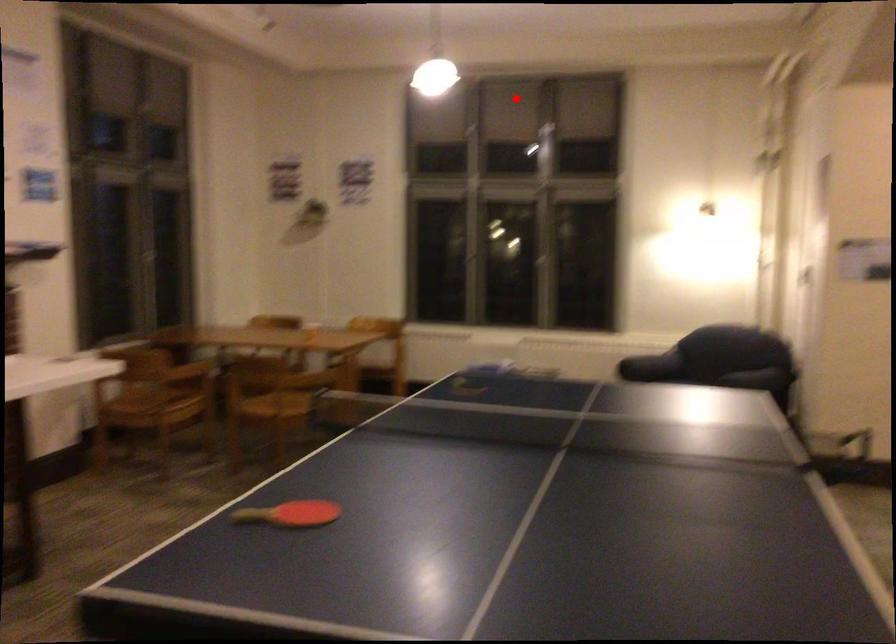
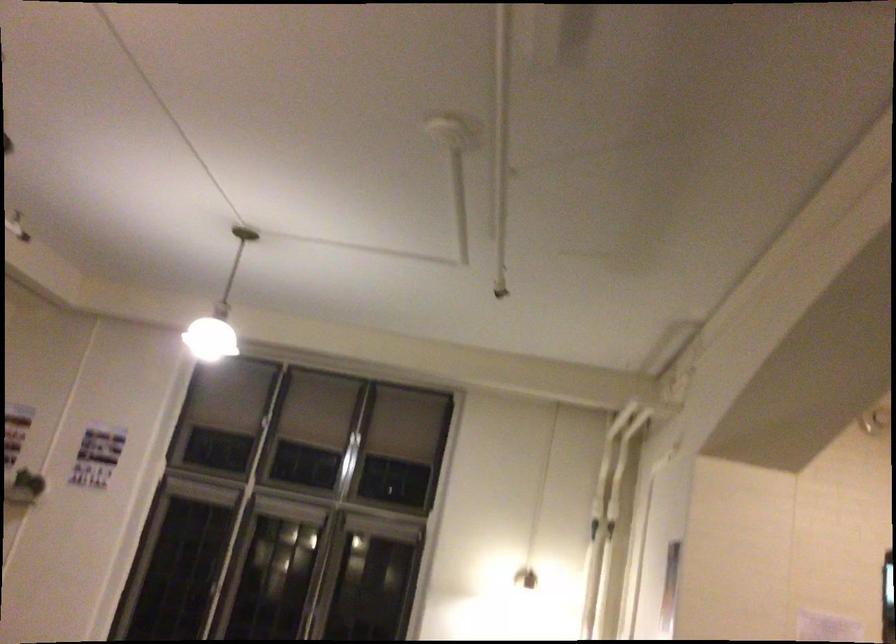
Question: A red point is marked in image1. In image2, is the corresponding 3D point closer to the camera or farther? Reply with the corresponding letter.

Choices:
 (A) The corresponding 3D point is closer.
 (B) The corresponding 3D point is farther.

Answer: (A)